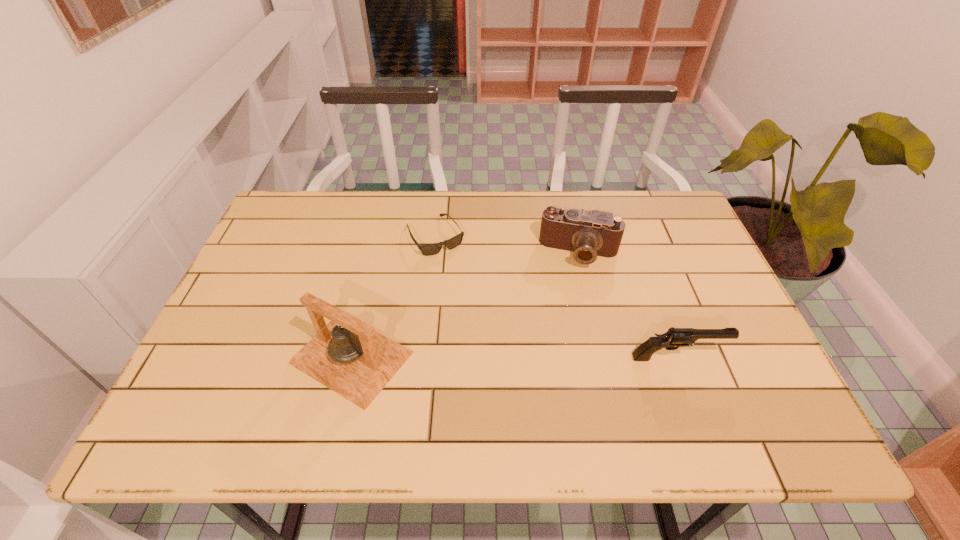
Find the location of a particular element. This screenshot has height=540, width=960. free spot on the desktop that is between the tallest object and the gun and is positioned on the front-facing side of the sunglasses is located at coordinates (515, 357).

I want to click on vacant space on the desktop that is between the tallest object and the gun and is positioned on the front-facing side of the camera, so click(563, 357).